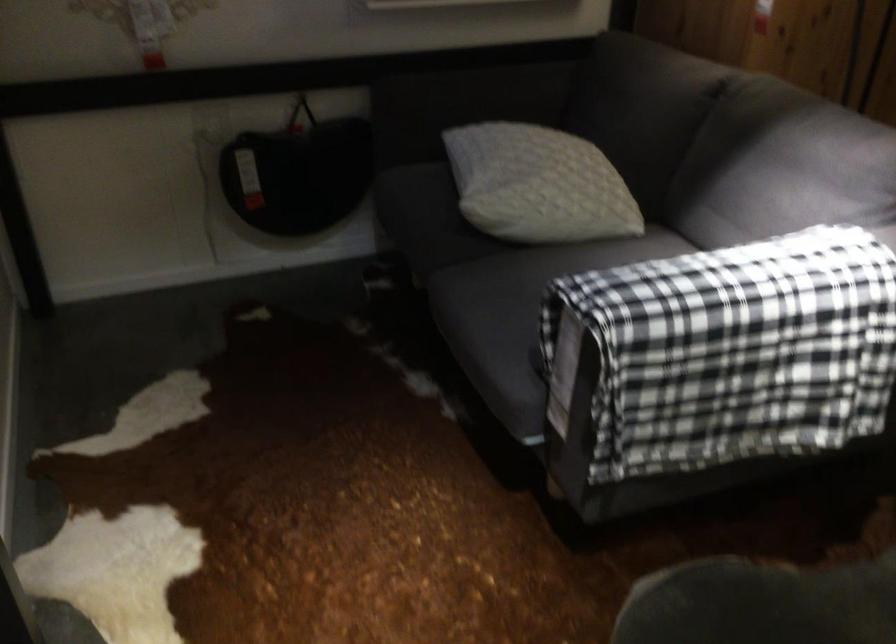
Identify the location of white quilted pillow. (538, 185).